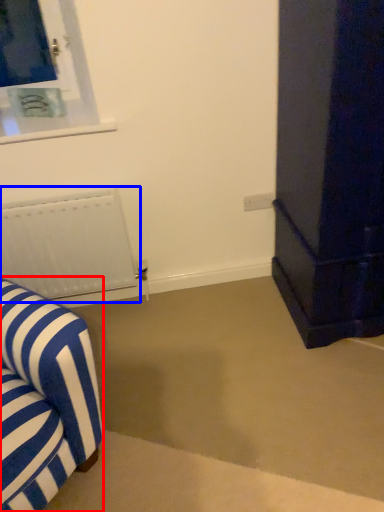
Question: Which of the following is the closest to the observer, furniture (highlighted by a red box) or radiator (highlighted by a blue box)?

Choices:
 (A) furniture
 (B) radiator

Answer: (A)